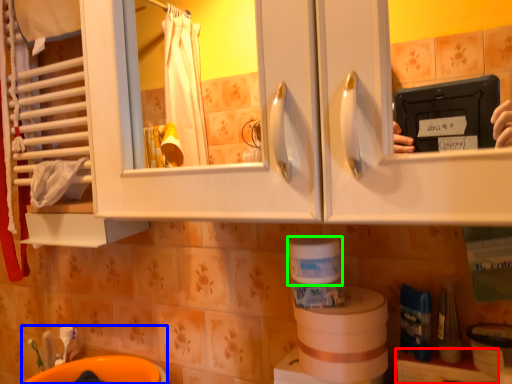
Question: Which is nearer to the shelf (highlighted by a red box)? sink (highlighted by a blue box) or toilet paper (highlighted by a green box).

Choices:
 (A) sink
 (B) toilet paper

Answer: (B)